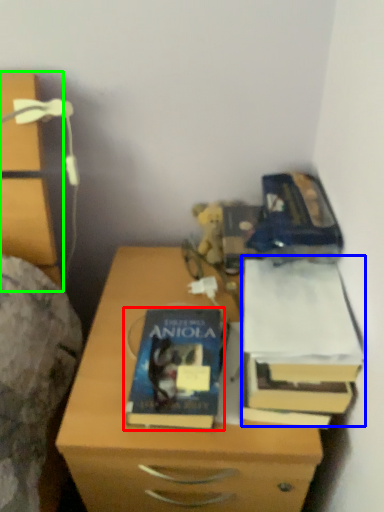
Question: Which is farther away from book (highlighted by a red box)? paperback book (highlighted by a blue box) or chest of drawers (highlighted by a green box)?

Choices:
 (A) paperback book
 (B) chest of drawers

Answer: (B)